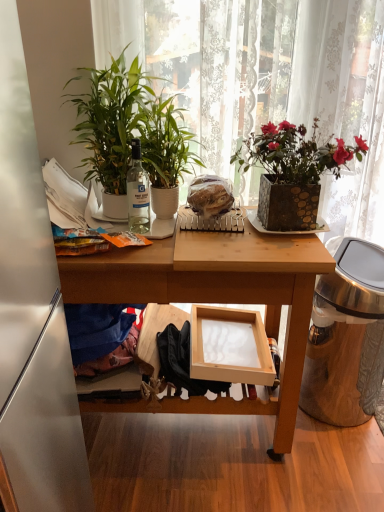
Question: Which is correct: white matte refrigerator at left is inside white lace curtain at upper center, or outside of it?

Choices:
 (A) outside
 (B) inside

Answer: (A)

Question: Relative to white lace curtain at upper center, is white matte refrigerator at left in front or behind?

Choices:
 (A) behind
 (B) front

Answer: (B)

Question: Which is farther from the wooden frame at lower center?

Choices:
 (A) green glossy plant at left, the second houseplant when ordered from right to left
 (B) blue cotton clothing at lower left
 (C) shiny metallic trash can at right
 (D) white lace curtain at upper center
 (E) green leafy plant at center, placed as the first houseplant when sorted from right to left

Answer: (D)

Question: Which of these objects is positioned closest to the green glossy plant at left, the second houseplant when ordered from right to left?

Choices:
 (A) white lace curtain at upper center
 (B) blue cotton clothing at lower left
 (C) wooden frame at lower center
 (D) translucent plastic bread at center
 (E) shiny metallic trash can at right

Answer: (D)